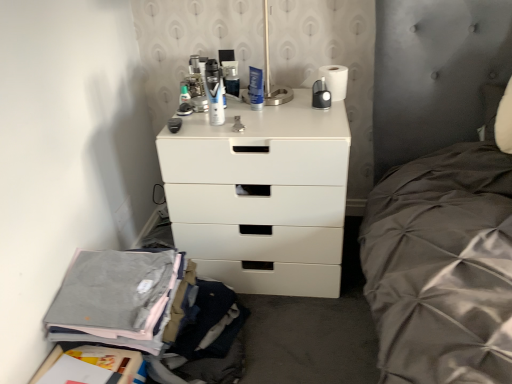
Identify the location of vacant area that is situated to the right of metallic silver can at center, which is counted as the first toiletry, starting from the right. Image resolution: width=512 pixels, height=384 pixels. click(270, 97).